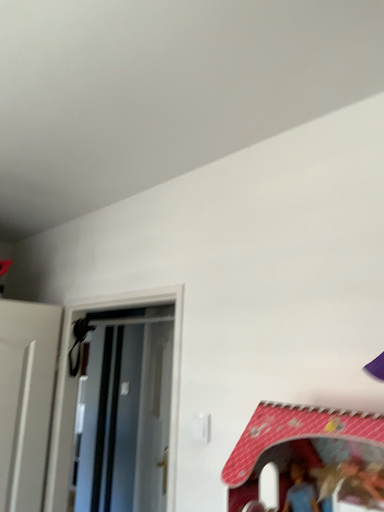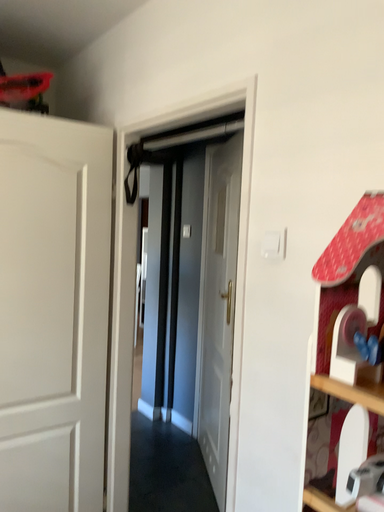
Question: How did the camera likely rotate when shooting the video?

Choices:
 (A) rotated downward
 (B) rotated upward

Answer: (A)